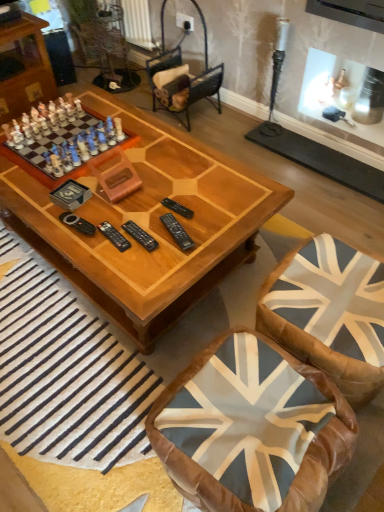
Find the location of a particular element. vacant space situated above wooden coffee table at center (from a real-world perspective) is located at coordinates (131, 184).